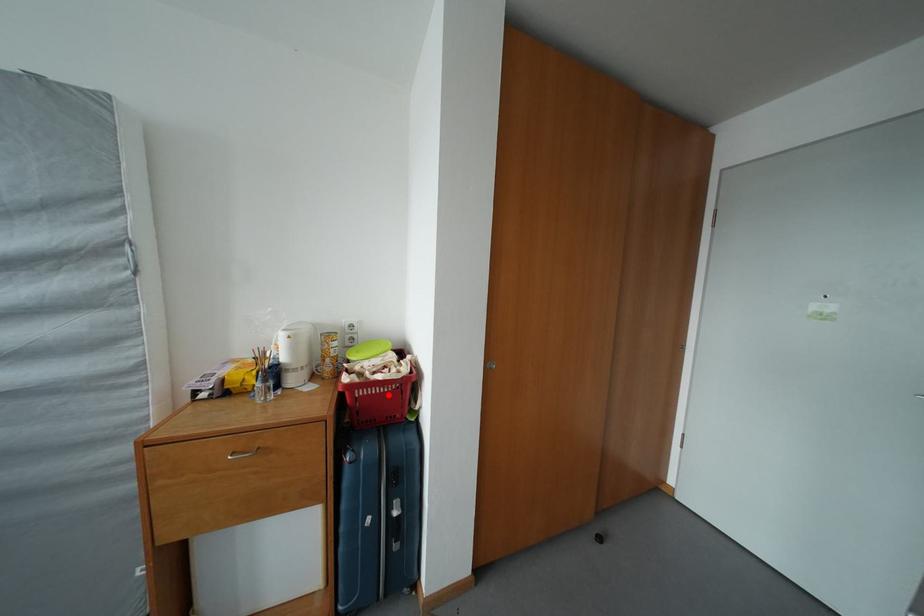
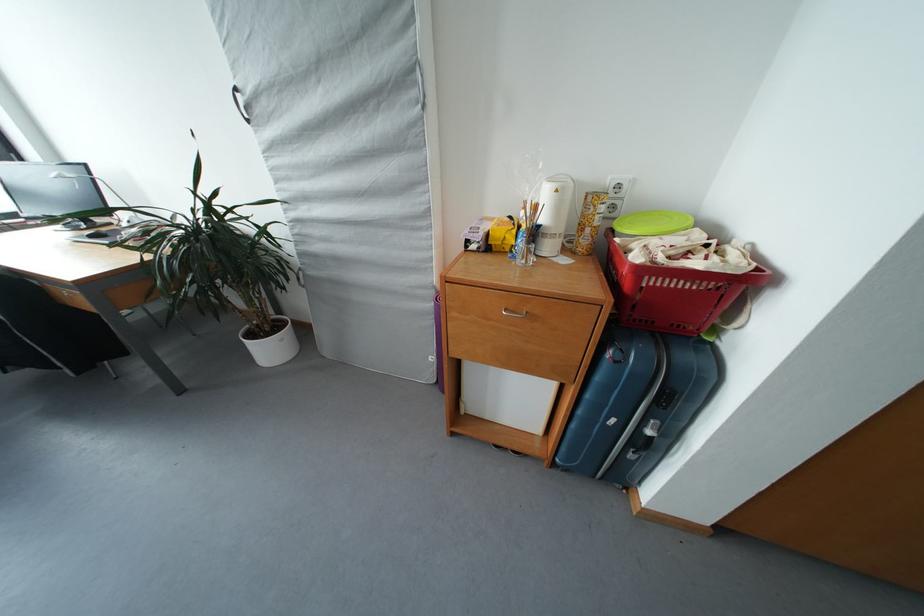
Find the pixel in the second image that matches the highlighted location in the first image.

(694, 291)